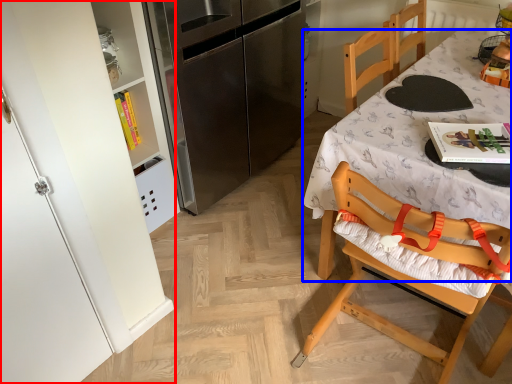
Question: Which object is further to the camera taking this photo, cabinetry (highlighted by a red box) or desk (highlighted by a blue box)?

Choices:
 (A) cabinetry
 (B) desk

Answer: (B)